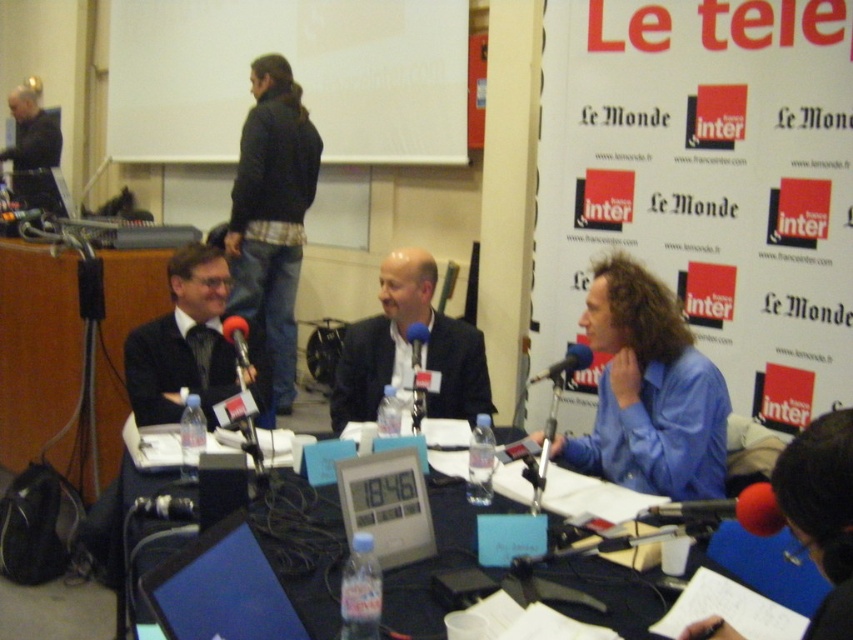
Question: Which object is closer to the camera taking this photo?

Choices:
 (A) black plastic table at center
 (B) blue shirt at right
 (C) black matte microphone at center
 (D) dark suit jacket at center

Answer: (A)

Question: Where is black matte microphone at center located in relation to matte black microphone at center in the image?

Choices:
 (A) right
 (B) left

Answer: (B)

Question: Among these points, which one is nearest to the camera?

Choices:
 (A) (244, 461)
 (B) (158, 500)
 (C) (418, 337)

Answer: (A)

Question: Is dark suit jacket at center wider than blue fabric at lower right?

Choices:
 (A) yes
 (B) no

Answer: (A)

Question: Based on their relative distances, which object is farther from the dark suit jacket at center?

Choices:
 (A) red foam microphone at lower right
 (B) blue fabric at lower right
 (C) dark gray suit at upper left

Answer: (C)

Question: Does dark suit jacket at center appear under red foam microphone at lower right?

Choices:
 (A) yes
 (B) no

Answer: (B)